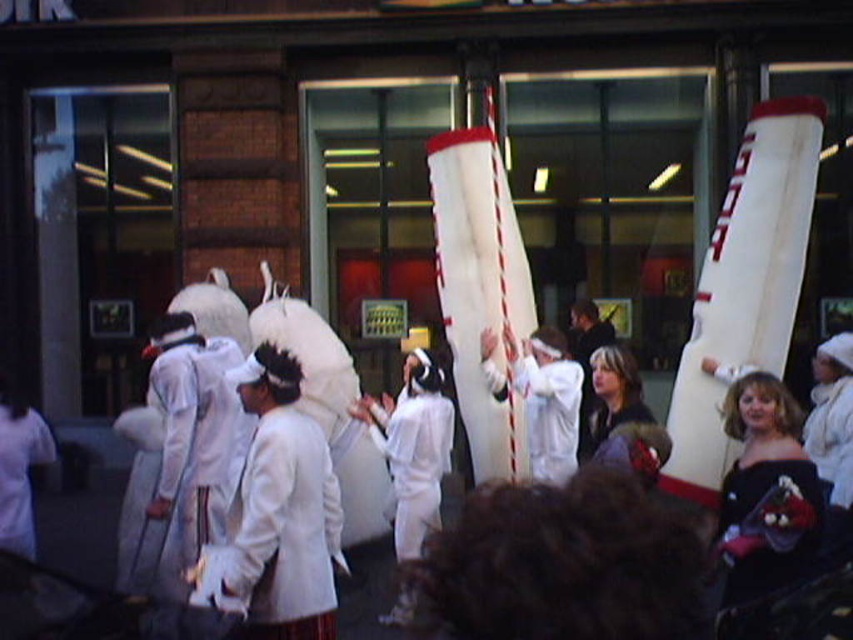
Which is behind, point (296, 586) or point (532, 346)?

The point (532, 346) is behind.

Between point (241, 602) and point (500, 390), which one is positioned in front?

Point (241, 602) is more forward.

The width and height of the screenshot is (853, 640). I want to click on white satin coat at center, so click(x=281, y=512).

Is white satin coat at center bigger than white matte/soft fabric costume at left?

Yes, white satin coat at center is bigger than white matte/soft fabric costume at left.

Is white satin coat at center shorter than white matte/soft fabric costume at left?

Incorrect, white satin coat at center's height does not fall short of white matte/soft fabric costume at left's.

Who is more forward, (329,500) or (4,468)?

Point (329,500) is in front.

You are a GUI agent. You are given a task and a screenshot of the screen. Output one action in this format:
    pyautogui.click(x=<x>, y=<y>)
    Task: Click on the white satin coat at center
    
    Given the screenshot: What is the action you would take?
    pyautogui.click(x=281, y=512)

Which is more to the left, white matte/soft fabric costume at left or white feathered headdress at center?

white matte/soft fabric costume at left is more to the left.

Is point (16, 435) less distant than point (583, 358)?

That is True.

Find the location of a particular element. This screenshot has width=853, height=640. white matte/soft fabric costume at left is located at coordinates (20, 474).